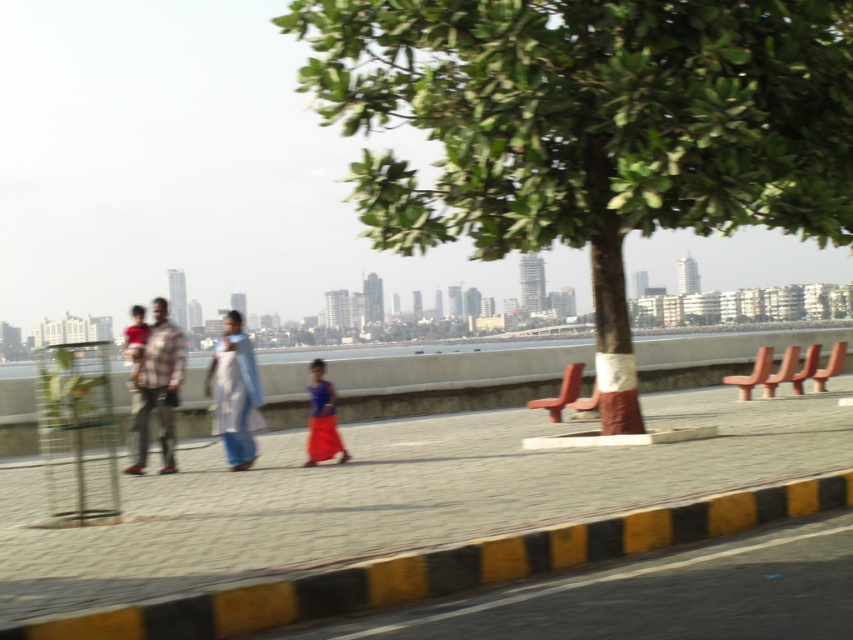
You are a photographer trying to capture a family portrait. You notice two adults in the scene, one wearing a plaid fabric shirt at center and the other a matte red shirt at left. Which adult should you focus on first if you want to ensure the tallest person is in the frame?

The plaid fabric shirt at center is taller than the matte red shirt at left, so you should focus on the adult wearing the plaid fabric shirt at center first to ensure the tallest person is in the frame.

You are a photographer positioned at the waterfront promenade. You need to capture a photo that includes both the blue fabric dress at center and the matte red shirt at left. Based on their positions, which object should you focus on first to ensure both are in frame?

The blue fabric dress at center is to the right of the matte red shirt at left. To ensure both are in frame, focus on the matte red shirt at left first, then adjust to include the blue fabric dress at center to the right.